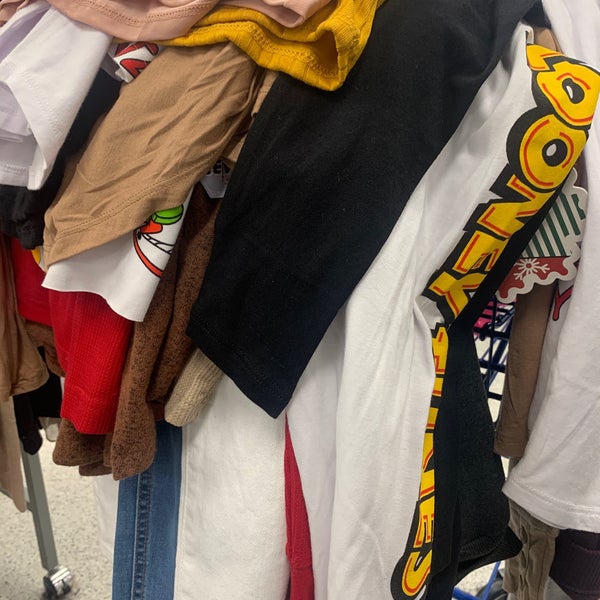
At what (x,y) coordinates should I click in order to perform the action: click on tan colored cloth. Please return your answer as a coordinate pair (x, y). The width and height of the screenshot is (600, 600). Looking at the image, I should click on (154, 141).